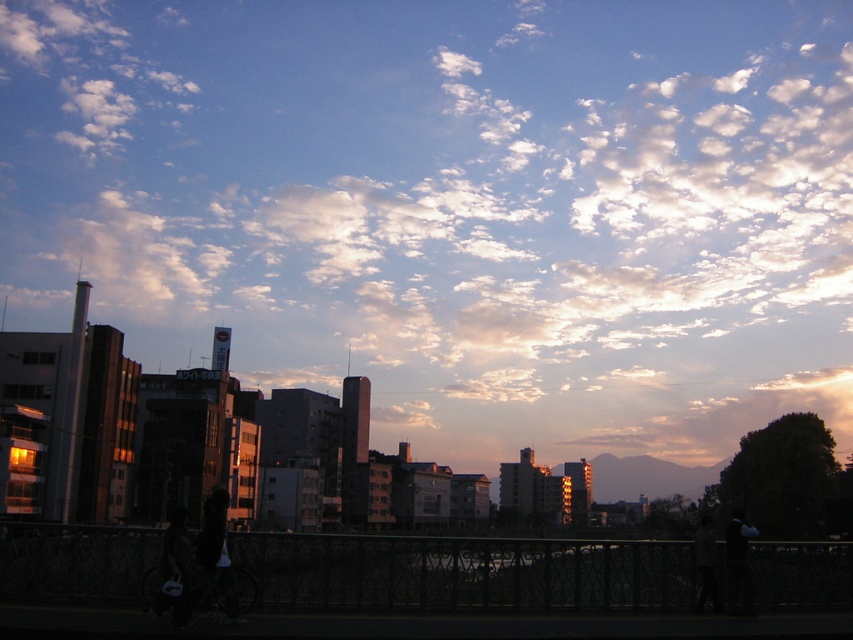
You are standing on a walkway with a metal railing in front of you. You see a white fluffy cloud at upper center and a dark blue fabric jacket at lower right. Which object is closer to you?

The white fluffy cloud at upper center is closer to you because it is further to the viewer than the dark blue fabric jacket at lower right.

In the scene shown: You are standing on a walkway with a metal railing and see two jackets hanging on the railing. The jackets are the dark fabric jacket at lower left and the dark blue fabric jacket at lower right. Which jacket is hanging higher up on the railing?

The dark fabric jacket at lower left is taller than the dark blue fabric jacket at lower right, so it is hanging higher up on the railing.

You are standing on a bridge overlooking the city and see two jackets. The dark fabric jacket at lower left and the dark blue fabric jacket at lower right. Which jacket is positioned higher from the ground?

The dark fabric jacket at lower left is positioned higher than the dark blue fabric jacket at lower right because it is above it.